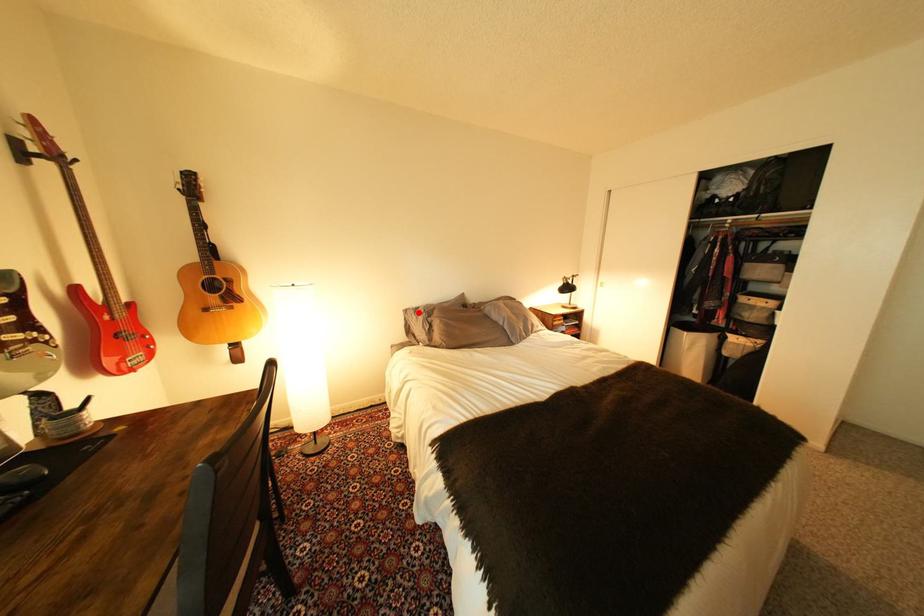
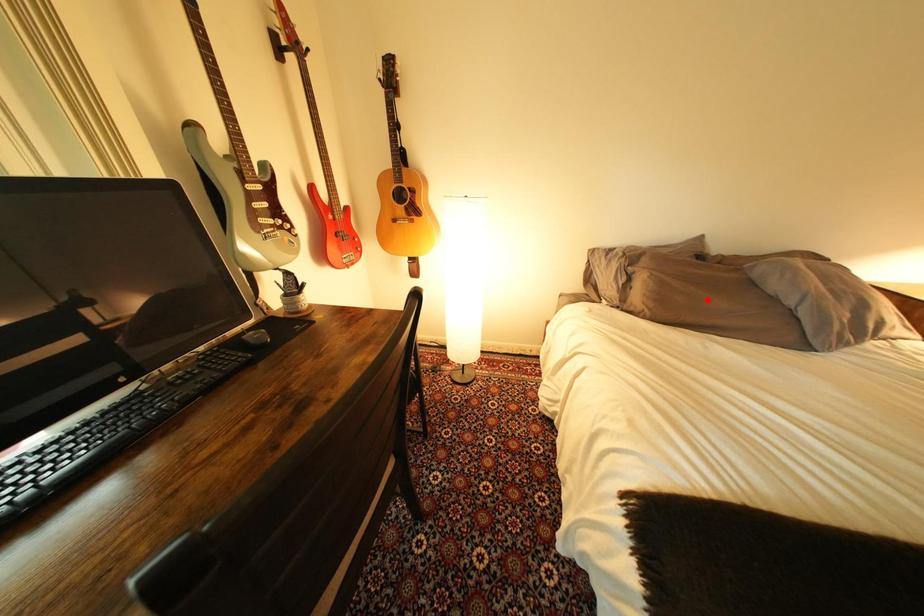
I am providing you with two images of the same scene from different viewpoints. A red point is marked on the first image and another point is marked on the second image. Is the marked point in image1 the same physical position as the marked point in image2?

No